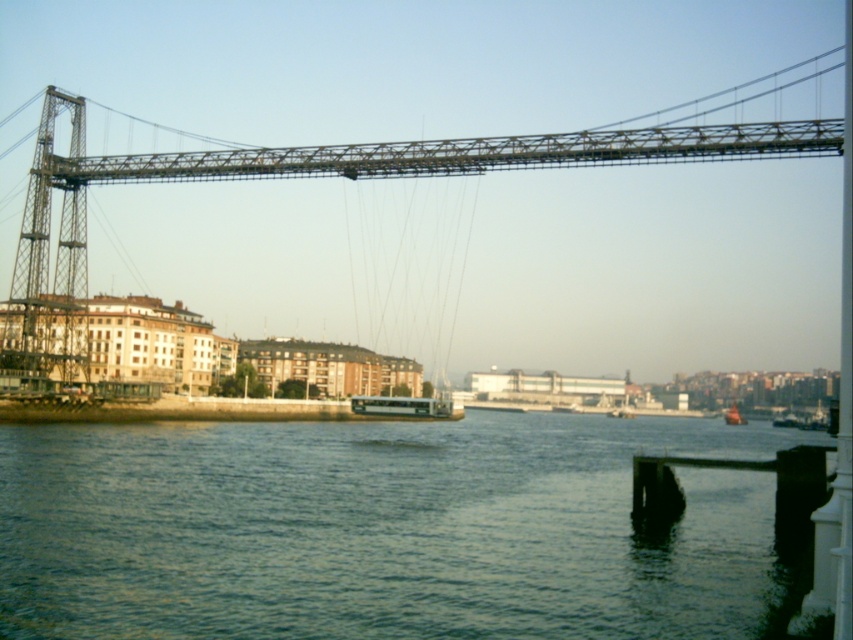
Measure the distance between point (86,561) and camera.

The distance of point (86,561) from camera is 54.59 meters.

Is greenish water at center bigger than metallic orange boat at lower right?

Yes, greenish water at center is bigger than metallic orange boat at lower right.

Is point (103, 627) positioned after point (723, 417)?

That is False.

Where is `greenish water at center`? greenish water at center is located at coordinates (380, 529).

Between point (804, 516) and point (741, 417), which one is positioned behind?

The point (741, 417) is behind.

Based on the photo, is dark wood dock at lower right smaller than metallic orange boat at lower right?

Actually, dark wood dock at lower right might be larger than metallic orange boat at lower right.

Is point (654, 456) more distant than point (737, 406)?

No, it is not.

Find the location of a particular element. dark wood dock at lower right is located at coordinates (735, 468).

Image resolution: width=853 pixels, height=640 pixels. What do you see at coordinates (380, 529) in the screenshot?
I see `greenish water at center` at bounding box center [380, 529].

Is point (10, 460) positioned in front of point (746, 467)?

No, it is behind (746, 467).

Locate an element on the screen. greenish water at center is located at coordinates (380, 529).

Where is `greenish water at center`? greenish water at center is located at coordinates [380, 529].